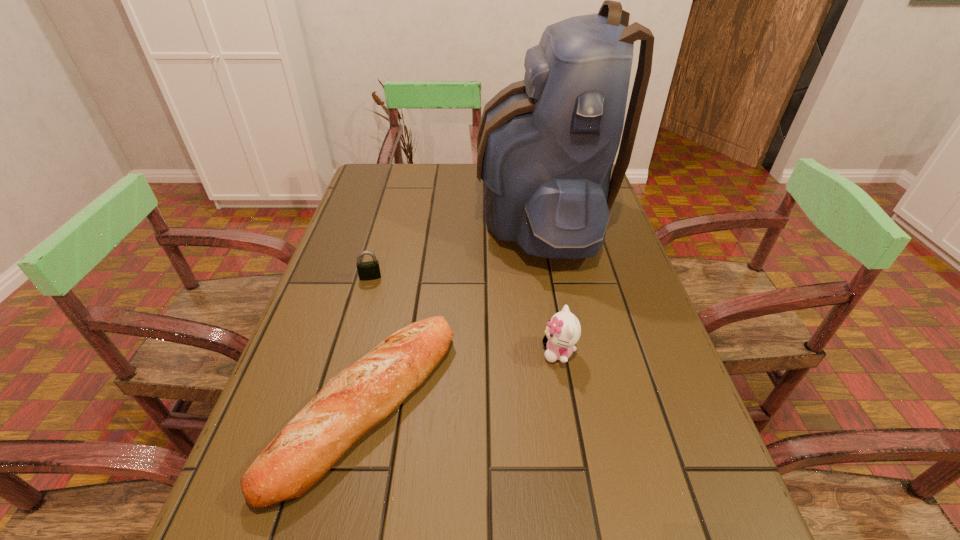
The width and height of the screenshot is (960, 540). I want to click on free region located on the back of the baguet, so click(x=400, y=252).

You are a GUI agent. You are given a task and a screenshot of the screen. Output one action in this format:
    pyautogui.click(x=<x>, y=<y>)
    Task: Click on the free space located 0.360m on the front of the padlock
    This screenshot has width=960, height=540.
    Given the screenshot: What is the action you would take?
    pyautogui.click(x=333, y=410)

This screenshot has width=960, height=540. What are the coordinates of `object at the far edge` in the screenshot? It's located at 546,145.

Where is `baguet situated at the left edge`? The height and width of the screenshot is (540, 960). baguet situated at the left edge is located at coordinates (353, 402).

Identify the location of padlock that is at the left edge. This screenshot has width=960, height=540. (370, 270).

Where is `object that is positioned at the right edge`? object that is positioned at the right edge is located at coordinates (546, 145).

I want to click on object located in the far right corner section of the desktop, so point(546,145).

Where is `blank space at the far edge`? This screenshot has width=960, height=540. blank space at the far edge is located at coordinates (460, 192).

Find the location of a particular element. free space at the left edge of the desktop is located at coordinates (333, 268).

Identify the location of free location at the right edge. (615, 387).